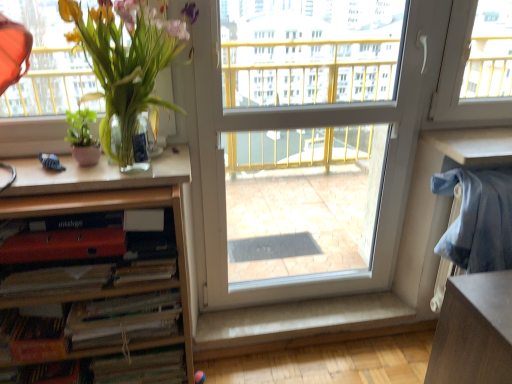
Question: Can you confirm if white plastic screen door at center is positioned to the right of wooden bookshelf at left?

Choices:
 (A) no
 (B) yes

Answer: (B)

Question: Is white plastic screen door at center smaller than wooden bookshelf at left?

Choices:
 (A) no
 (B) yes

Answer: (A)

Question: Is white plastic screen door at center turned away from wooden bookshelf at left?

Choices:
 (A) yes
 (B) no

Answer: (B)

Question: Is white plastic screen door at center thinner than wooden bookshelf at left?

Choices:
 (A) no
 (B) yes

Answer: (B)

Question: Is white plastic screen door at center further to the viewer compared to wooden bookshelf at left?

Choices:
 (A) no
 (B) yes

Answer: (B)

Question: Relative to matte red paperback book at lower left, which is the 1th paperback book in top-to-bottom order, is matte red book at lower left in front or behind?

Choices:
 (A) behind
 (B) front

Answer: (A)

Question: Is point click(x=152, y=279) positioned closer to the camera than point click(x=115, y=246)?

Choices:
 (A) farther
 (B) closer

Answer: (A)

Question: Considering the positions of matte red book at lower left and matte red paperback book at lower left, the third paperback book ordered from the bottom, in the image, is matte red book at lower left bigger or smaller than matte red paperback book at lower left, the third paperback book ordered from the bottom,?

Choices:
 (A) big
 (B) small

Answer: (A)

Question: Based on their positions, is matte red book at lower left located to the left or right of matte red paperback book at lower left, which is the 1th paperback book in top-to-bottom order?

Choices:
 (A) right
 (B) left

Answer: (B)

Question: In terms of height, does wooden bookshelf at left look taller or shorter compared to white fabric at lower center?

Choices:
 (A) short
 (B) tall

Answer: (B)

Question: In the image, is wooden bookshelf at left on the left side or the right side of white fabric at lower center?

Choices:
 (A) left
 (B) right

Answer: (A)

Question: From the image's perspective, is wooden bookshelf at left positioned above or below white fabric at lower center?

Choices:
 (A) above
 (B) below

Answer: (A)

Question: Is wooden bookshelf at left wider or thinner than white fabric at lower center?

Choices:
 (A) wide
 (B) thin

Answer: (A)

Question: From a real-world perspective, is hardcover book at lower left, the first paperback book ordered from the bottom, above or below green matte plant at left, marked as the first houseplant in a left-to-right arrangement?

Choices:
 (A) below
 (B) above

Answer: (A)

Question: Is hardcover book at lower left, marked as the 3th paperback book in a top-to-bottom arrangement, wider or thinner than green matte plant at left, the second houseplant viewed from the right?

Choices:
 (A) wide
 (B) thin

Answer: (A)